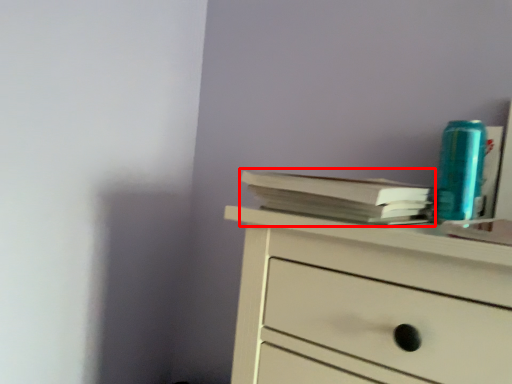
Question: From the image's perspective, where is paperback book (annotated by the red box) located in relation to teal in the image?

Choices:
 (A) above
 (B) below

Answer: (B)